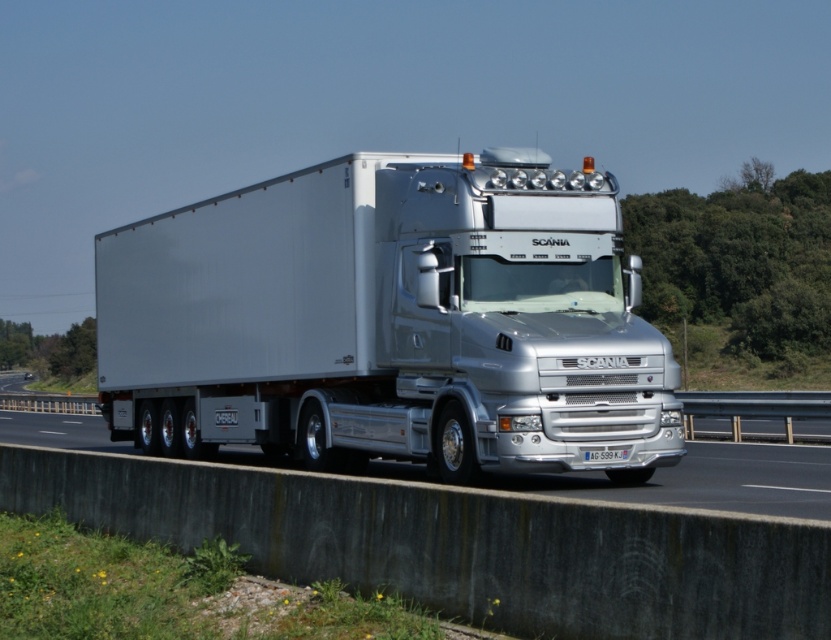
Can you confirm if silver metallic truck at center is shorter than silver metallic highway at center?

Incorrect, silver metallic truck at center's height does not fall short of silver metallic highway at center's.

Based on the photo, can you confirm if silver metallic truck at center is bigger than silver metallic highway at center?

Incorrect, silver metallic truck at center is not larger than silver metallic highway at center.

Find the location of a particular element. This screenshot has height=640, width=831. silver metallic truck at center is located at coordinates (391, 321).